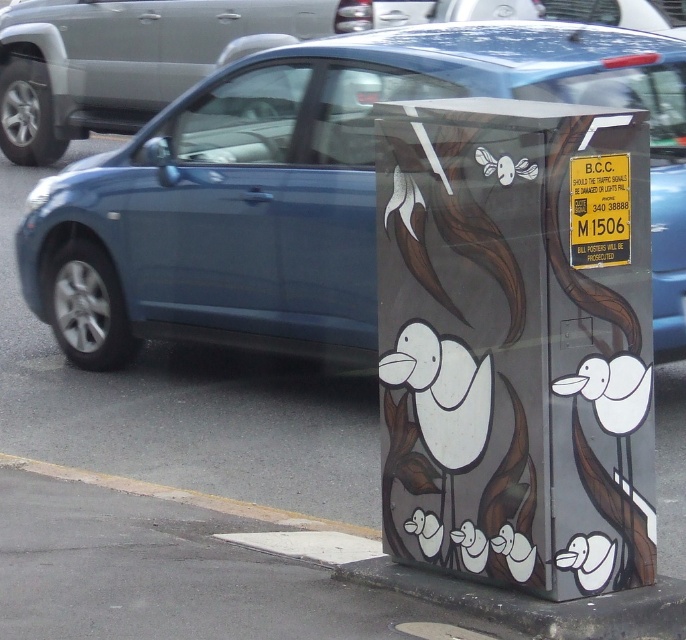
You are a delivery driver who needs to park your vehicle near the utility box with the birds. The parking regulations require you to stay within 5 meters of the utility box but not closer than 1 meter to any curb. Based on the smooth concrete curb at lower left, is your parking spot compliant with the regulations?

The smooth concrete curb at lower left is located at point (217, 570). Since the parking spot must be at least 1 meter away from the curb, the driver must ensure their vehicle is parked no closer than 1 meter from the curb. However, without knowing the exact distance between the parking spot and the curb, it is impossible to confirm compliance with the regulations.

You are a delivery driver who needs to park your vehicle near the utility box with the bird artwork. The parking meter you need to pay is located at a specific coordinate. What are the coordinates of the matte glass parking meter at center?

The coordinates of the matte glass parking meter at center are at point (517,342).